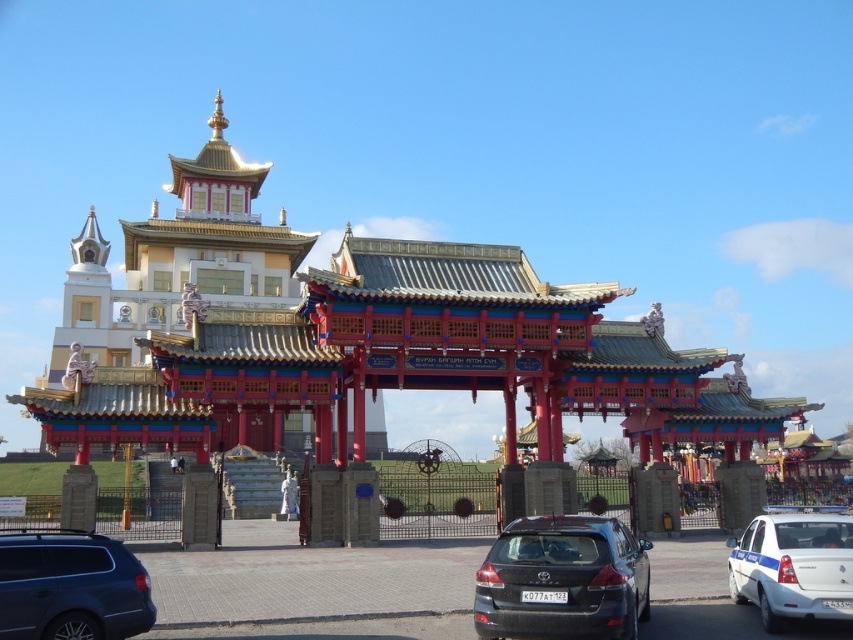
Is metallic gray suv at lower left thinner than white glossy police car at lower right?

Yes, metallic gray suv at lower left is thinner than white glossy police car at lower right.

Describe the element at coordinates (71, 588) in the screenshot. The image size is (853, 640). I see `metallic gray suv at lower left` at that location.

The height and width of the screenshot is (640, 853). Identify the location of metallic gray suv at lower left. (71, 588).

Is gold/polished metal palace at center positioned behind metallic gray suv at lower left?

That is True.

Find the location of a particular element. gold/polished metal palace at center is located at coordinates (363, 340).

Between point (407, 355) and point (129, 596), which one is positioned behind?

The point (407, 355) is behind.

Find the location of `gold/polished metal palace at center`. gold/polished metal palace at center is located at coordinates (363, 340).

Can you confirm if matte black car at center is positioned above white glossy police car at lower right?

No, matte black car at center is not above white glossy police car at lower right.

Can you confirm if matte black car at center is wider than white glossy police car at lower right?

Yes, matte black car at center is wider than white glossy police car at lower right.

Does point (538, 632) come in front of point (749, 593)?

Yes.

Locate an element on the screen. The width and height of the screenshot is (853, 640). matte black car at center is located at coordinates (561, 580).